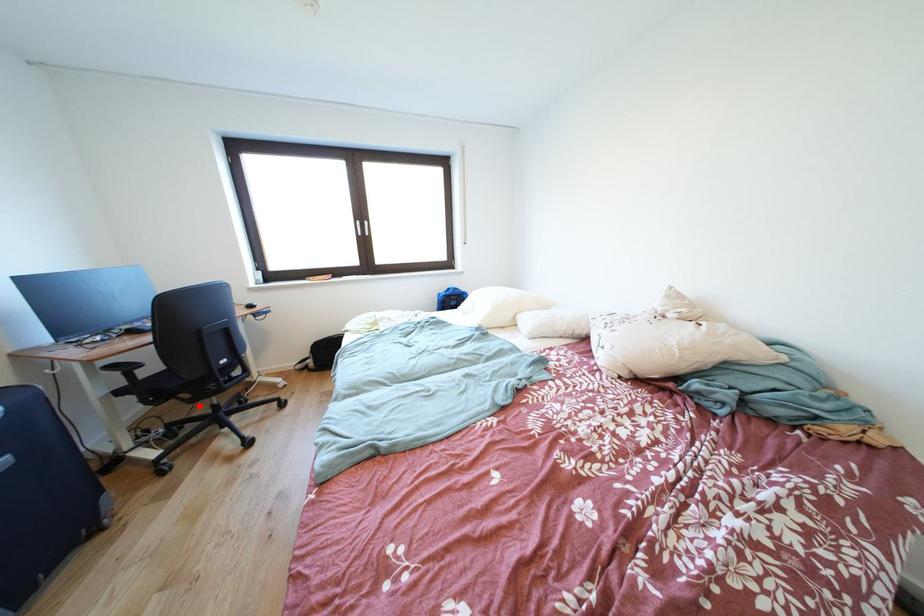
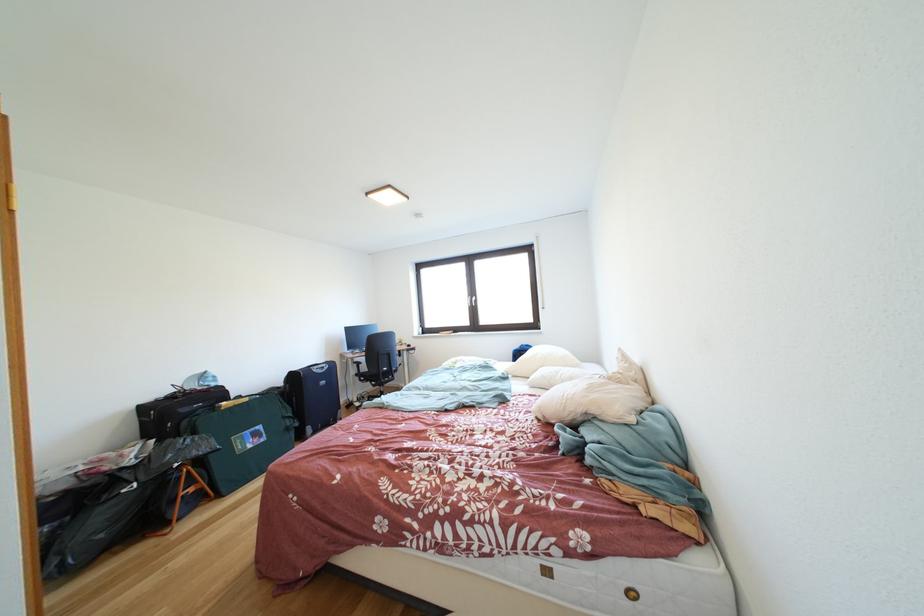
Question: I am providing you with two images of the same scene from different viewpoints. Image1 has a red point marked. In image2, the corresponding 3D location appears at what relative position? Reply with the corresponding letter.

Choices:
 (A) Closer
 (B) Farther

Answer: (B)